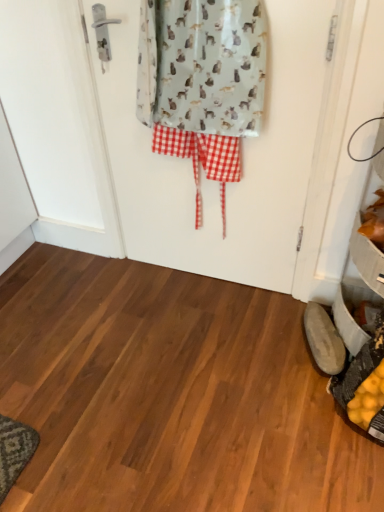
Question: Would you say light gray fabric screen door at center is a long distance from brown leather shoe at lower right?

Choices:
 (A) yes
 (B) no

Answer: (B)

Question: Is light gray fabric screen door at center turned away from brown leather shoe at lower right?

Choices:
 (A) no
 (B) yes

Answer: (A)

Question: Is light gray fabric screen door at center closer to camera compared to brown leather shoe at lower right?

Choices:
 (A) yes
 (B) no

Answer: (A)

Question: From the image's perspective, does light gray fabric screen door at center appear higher than brown leather shoe at lower right?

Choices:
 (A) no
 (B) yes

Answer: (B)

Question: From a real-world perspective, is light gray fabric screen door at center positioned over brown leather shoe at lower right based on gravity?

Choices:
 (A) yes
 (B) no

Answer: (A)

Question: Looking at their shapes, would you say orange matte leaves at lower right is wider or thinner than brown leather shoe at lower right?

Choices:
 (A) thin
 (B) wide

Answer: (B)

Question: From the image's perspective, is orange matte leaves at lower right positioned above or below brown leather shoe at lower right?

Choices:
 (A) above
 (B) below

Answer: (A)

Question: Is point (374, 215) positioned closer to the camera than point (324, 317)?

Choices:
 (A) farther
 (B) closer

Answer: (B)

Question: In the image, is orange matte leaves at lower right positioned in front of or behind brown leather shoe at lower right?

Choices:
 (A) behind
 (B) front

Answer: (B)

Question: From a real-world perspective, is brown leather shoe at lower right above or below light gray fabric with cat print at center?

Choices:
 (A) above
 (B) below

Answer: (B)

Question: Is brown leather shoe at lower right situated inside light gray fabric with cat print at center or outside?

Choices:
 (A) outside
 (B) inside

Answer: (A)

Question: In terms of width, does brown leather shoe at lower right look wider or thinner when compared to light gray fabric with cat print at center?

Choices:
 (A) wide
 (B) thin

Answer: (B)

Question: Is brown leather shoe at lower right bigger or smaller than light gray fabric with cat print at center?

Choices:
 (A) big
 (B) small

Answer: (B)

Question: Which is correct: light gray fabric screen door at center is inside light gray fabric with cat print at center, or outside of it?

Choices:
 (A) inside
 (B) outside

Answer: (A)

Question: Considering the positions of light gray fabric screen door at center and light gray fabric with cat print at center in the image, is light gray fabric screen door at center taller or shorter than light gray fabric with cat print at center?

Choices:
 (A) short
 (B) tall

Answer: (B)